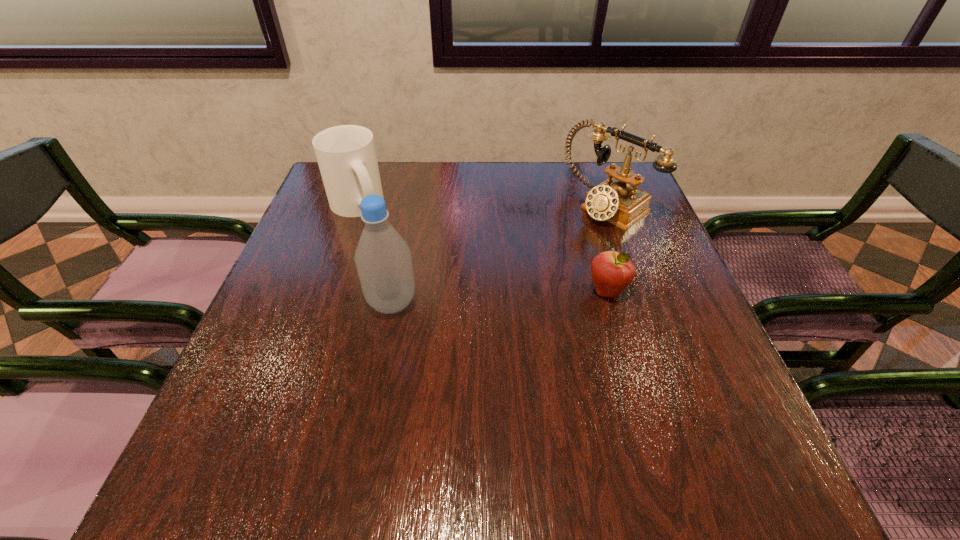
This screenshot has height=540, width=960. I want to click on vacant spot on the desktop that is between the bottle and the shortest object and is positioned on the handle side of the mug, so click(x=477, y=298).

Find the location of a particular element. free space on the desktop that is between the bottle and the apple and is positioned on the dial number of the telephone is located at coordinates (469, 299).